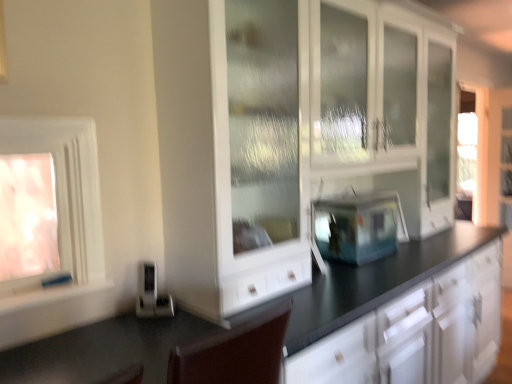
Locate an element on the screen. Image resolution: width=512 pixels, height=384 pixels. free space above white matte window sill at lower left (from a real-world perspective) is located at coordinates (53, 290).